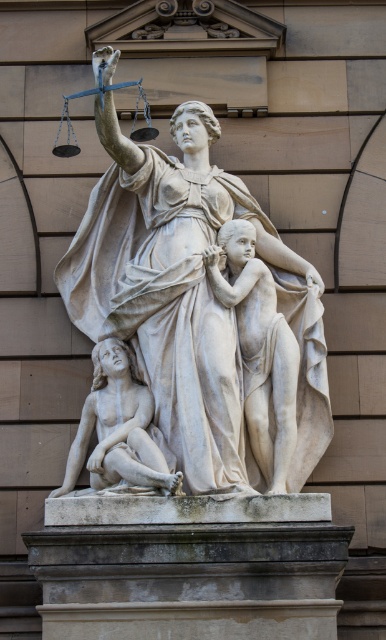
Which of these two, white marble statue at center or white marble figure at lower left, stands shorter?

white marble figure at lower left is shorter.

Does white marble statue at center have a lesser width compared to white marble figure at lower left?

In fact, white marble statue at center might be wider than white marble figure at lower left.

Image resolution: width=386 pixels, height=640 pixels. What are the coordinates of `white marble statue at center` in the screenshot? It's located at click(203, 308).

Who is positioned more to the right, white marble statue at center or white marble nude figure at center?

white marble nude figure at center is more to the right.

Does white marble statue at center have a lesser width compared to white marble nude figure at center?

No.

Is point (309, 454) positioned after point (262, 470)?

Yes.

I want to click on white marble statue at center, so click(x=203, y=308).

Which of these two, white marble nude figure at center or white marble figure at lower left, stands shorter?

white marble figure at lower left

Is point (287, 417) closer to viewer compared to point (130, 368)?

Yes, point (287, 417) is closer to viewer.

What do you see at coordinates (259, 348) in the screenshot? I see `white marble nude figure at center` at bounding box center [259, 348].

At what (x,y) coordinates should I click in order to perform the action: click on white marble nude figure at center. Please return your answer as a coordinate pair (x, y). The height and width of the screenshot is (640, 386). Looking at the image, I should click on (259, 348).